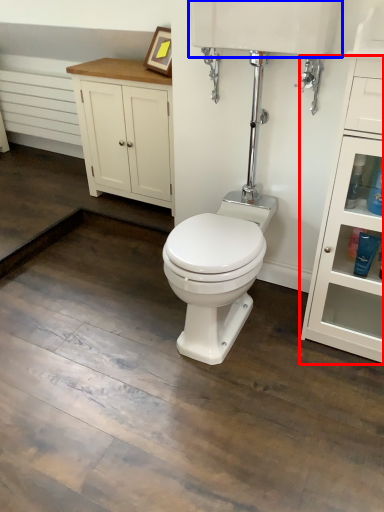
Question: Which of the following is the farthest to the observer, dresser (highlighted by a red box) or sink (highlighted by a blue box)?

Choices:
 (A) dresser
 (B) sink

Answer: (B)